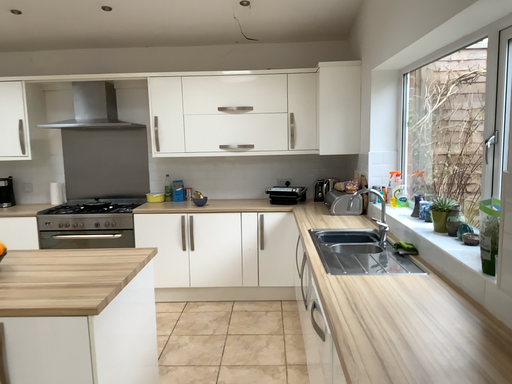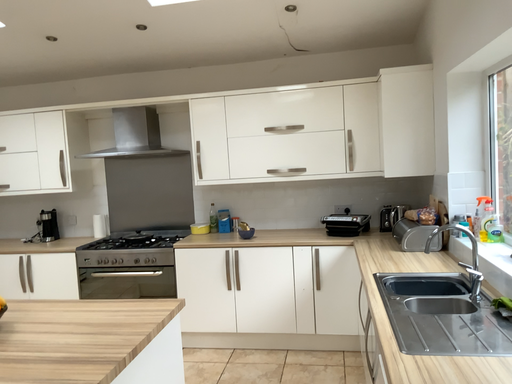
Question: How did the camera likely rotate when shooting the video?

Choices:
 (A) rotated left
 (B) rotated right

Answer: (A)